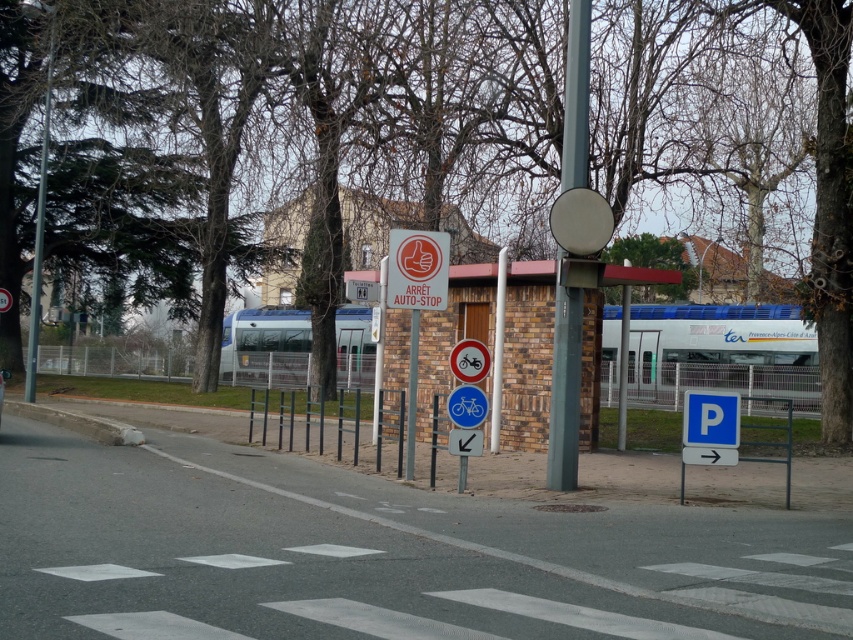
Is red plastic sign at center taller than white plastic bicycle at center?

Yes, red plastic sign at center is taller than white plastic bicycle at center.

Between red plastic sign at center and white plastic bicycle at center, which one appears on the right side from the viewer's perspective?

From the viewer's perspective, white plastic bicycle at center appears more on the right side.

Where is `red plastic sign at center`? This screenshot has width=853, height=640. red plastic sign at center is located at coordinates (416, 269).

You are a GUI agent. You are given a task and a screenshot of the screen. Output one action in this format:
    pyautogui.click(x=<x>, y=<y>)
    Task: Click on the red plastic sign at center
    
    Given the screenshot: What is the action you would take?
    pyautogui.click(x=416, y=269)

Who is positioned more to the right, brick wall bus stop at center or red plastic sign at center?

From the viewer's perspective, red plastic sign at center appears more on the right side.

Describe the element at coordinates (527, 355) in the screenshot. I see `brick wall bus stop at center` at that location.

Looking at this image, who is more forward, (523, 372) or (407, 232)?

Point (407, 232) is more forward.

Find the location of a particular element. This screenshot has width=853, height=640. brick wall bus stop at center is located at coordinates (527, 355).

Who is positioned more to the right, blue plastic parking sign at lower right or red plastic sign at center?

blue plastic parking sign at lower right is more to the right.

The width and height of the screenshot is (853, 640). I want to click on blue plastic parking sign at lower right, so click(x=726, y=433).